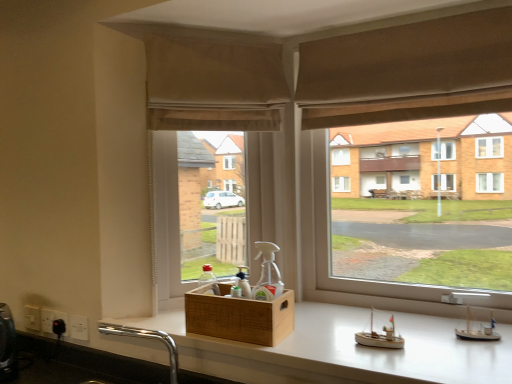
The image size is (512, 384). I want to click on free point above wooden crate at center (from a real-world perspective), so [x=249, y=289].